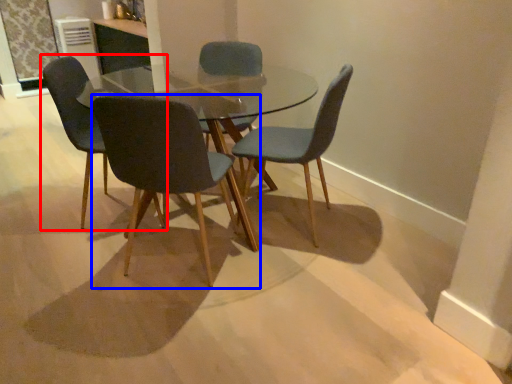
Question: Which object appears farthest to the camera in this image, chair (highlighted by a red box) or chair (highlighted by a blue box)?

Choices:
 (A) chair
 (B) chair

Answer: (A)